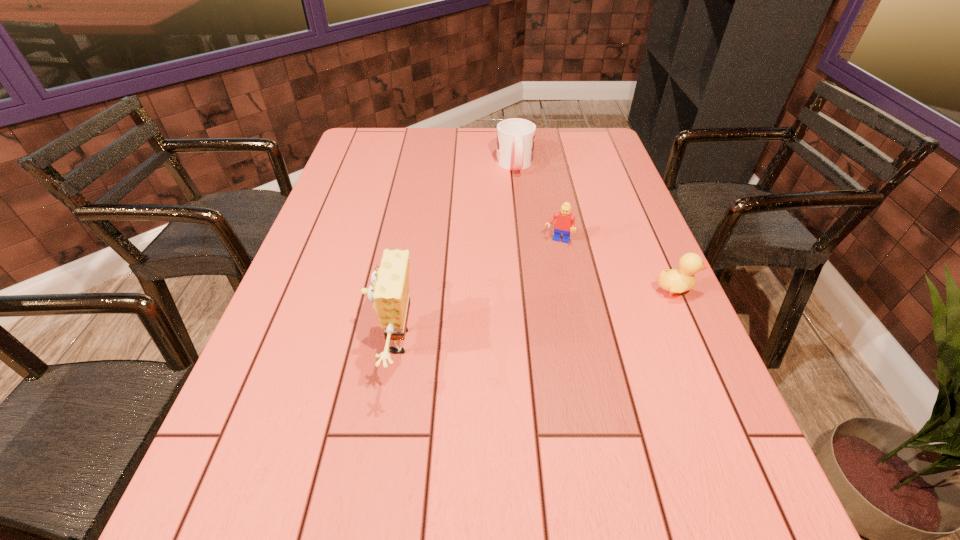
This screenshot has width=960, height=540. I want to click on free space on the desktop that is between the tallest object and the duckling and is positioned on the side of the mug with the handle, so click(543, 316).

Find the location of a particular element. vacant spot on the desktop that is between the leftmost object and the rightmost object and is positioned on the front-facing side of the second farthest object is located at coordinates (531, 318).